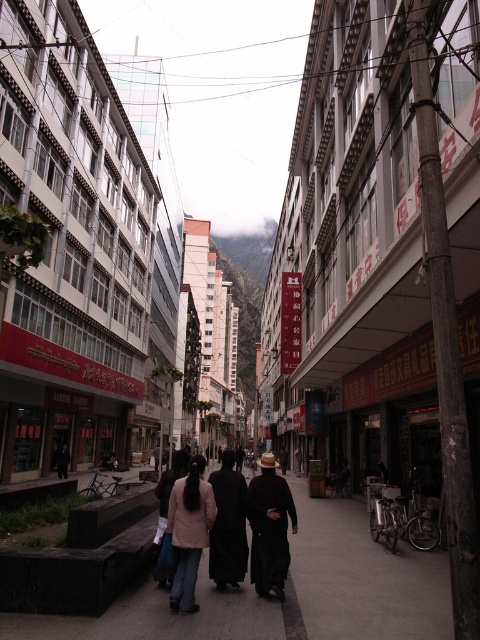
You are a pedestrian walking down this busy street and you see both the black matte coat at center and the light pink fabric jacket at center. Which one is closer to you?

The black matte coat at center is closer to you because the light pink fabric jacket at center is behind it.

You are a pedestrian standing on the dark gray concrete pavement at center and you see the light pink fabric jacket at center ahead. Can you step onto the jacket without moving your feet from the pavement?

The dark gray concrete pavement at center is closer to the viewer than the light pink fabric jacket at center, so the jacket is further away. Therefore, you cannot step onto the jacket without moving your feet from the pavement.

You are a delivery person who needs to place a package on the ground. You see the dark gray concrete pavement at center and the light pink fabric jacket at center. Which surface is more suitable for placing the package?

The dark gray concrete pavement at center is larger in size than the light pink fabric jacket at center, so it is more suitable for placing the package as it provides a stable and spacious surface.